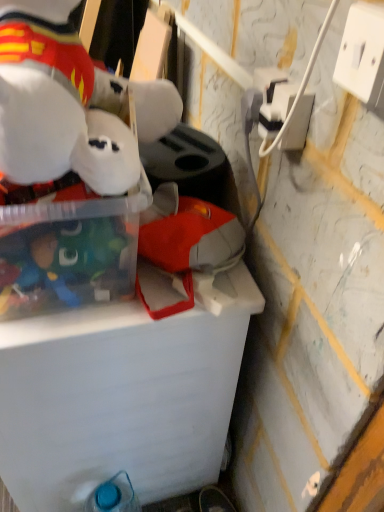
Question: Does transparent plastic storage box at upper left have a larger size compared to white plastic power outlet at upper right, arranged as the 1th power outlet when viewed from the front?

Choices:
 (A) no
 (B) yes

Answer: (B)

Question: Is transparent plastic storage box at upper left positioned before white plastic power outlet at upper right, the 2th power outlet when ordered from left to right?

Choices:
 (A) yes
 (B) no

Answer: (B)

Question: Can you confirm if transparent plastic storage box at upper left is positioned to the right of white plastic power outlet at upper right, which is the first power outlet in right-to-left order?

Choices:
 (A) no
 (B) yes

Answer: (A)

Question: Is transparent plastic storage box at upper left outside white plastic power outlet at upper right, arranged as the 1th power outlet when viewed from the front?

Choices:
 (A) no
 (B) yes

Answer: (B)

Question: Is transparent plastic storage box at upper left positioned with its back to white plastic power outlet at upper right, which is the first power outlet in right-to-left order?

Choices:
 (A) no
 (B) yes

Answer: (A)

Question: Does transparent plastic storage box at upper left have a lesser height compared to white plastic power outlet at upper right, acting as the 2th power outlet starting from the back?

Choices:
 (A) no
 (B) yes

Answer: (A)

Question: Can you confirm if blue plastic bottle at lower left is smaller than transparent plastic storage box at upper left?

Choices:
 (A) yes
 (B) no

Answer: (A)

Question: From the image's perspective, is blue plastic bottle at lower left over transparent plastic storage box at upper left?

Choices:
 (A) no
 (B) yes

Answer: (A)

Question: Can you confirm if blue plastic bottle at lower left is positioned to the right of transparent plastic storage box at upper left?

Choices:
 (A) yes
 (B) no

Answer: (A)

Question: Would you say blue plastic bottle at lower left contains transparent plastic storage box at upper left?

Choices:
 (A) no
 (B) yes

Answer: (A)

Question: Does blue plastic bottle at lower left have a greater height compared to transparent plastic storage box at upper left?

Choices:
 (A) yes
 (B) no

Answer: (A)

Question: Does blue plastic bottle at lower left touch transparent plastic storage box at upper left?

Choices:
 (A) no
 (B) yes

Answer: (A)

Question: Is blue plastic bottle at lower left a part of white plastic power outlet at upper right, the 2th power outlet when ordered from left to right?

Choices:
 (A) yes
 (B) no

Answer: (B)